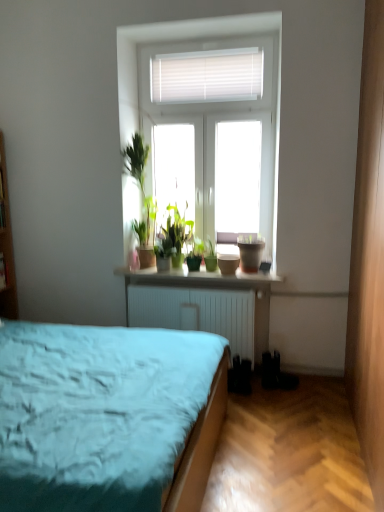
Question: Is green matte plant at center, the 1th houseplant when ordered from left to right, turned away from green matte plant at center, which appears as the second houseplant when viewed from the left?

Choices:
 (A) no
 (B) yes

Answer: (A)

Question: Is green matte plant at center, the 1th houseplant when ordered from left to right, in contact with green matte plant at center, which appears as the second houseplant when viewed from the left?

Choices:
 (A) no
 (B) yes

Answer: (B)

Question: Could you tell me if green matte plant at center, acting as the second houseplant starting from the right, is facing green matte plant at center, marked as the 1th houseplant in a right-to-left arrangement?

Choices:
 (A) yes
 (B) no

Answer: (B)

Question: From a real-world perspective, is green matte plant at center, acting as the second houseplant starting from the right, on top of green matte plant at center, which appears as the second houseplant when viewed from the left?

Choices:
 (A) no
 (B) yes

Answer: (B)

Question: Is green matte plant at center, acting as the second houseplant starting from the right, bigger than green matte plant at center, marked as the 1th houseplant in a right-to-left arrangement?

Choices:
 (A) yes
 (B) no

Answer: (A)

Question: Are green matte plant at center, the 1th houseplant when ordered from left to right, and green matte plant at center, which appears as the second houseplant when viewed from the left, located far from each other?

Choices:
 (A) yes
 (B) no

Answer: (B)

Question: Is there a large distance between matte ceramic pots at center and matte brown flowerpot at window?

Choices:
 (A) no
 (B) yes

Answer: (A)

Question: Considering the relative sizes of matte ceramic pots at center and matte brown flowerpot at window in the image provided, is matte ceramic pots at center bigger than matte brown flowerpot at window?

Choices:
 (A) no
 (B) yes

Answer: (B)

Question: Is matte ceramic pots at center behind matte brown flowerpot at window?

Choices:
 (A) yes
 (B) no

Answer: (B)

Question: From a real-world perspective, is matte ceramic pots at center positioned under matte brown flowerpot at window based on gravity?

Choices:
 (A) yes
 (B) no

Answer: (A)

Question: From a real-world perspective, is matte ceramic pots at center on matte brown flowerpot at window?

Choices:
 (A) yes
 (B) no

Answer: (B)

Question: Is matte ceramic pots at center to the left of matte brown flowerpot at window from the viewer's perspective?

Choices:
 (A) yes
 (B) no

Answer: (A)

Question: Is matte brown flowerpot at window at the back of green matte plant at center, acting as the second houseplant starting from the right?

Choices:
 (A) yes
 (B) no

Answer: (B)